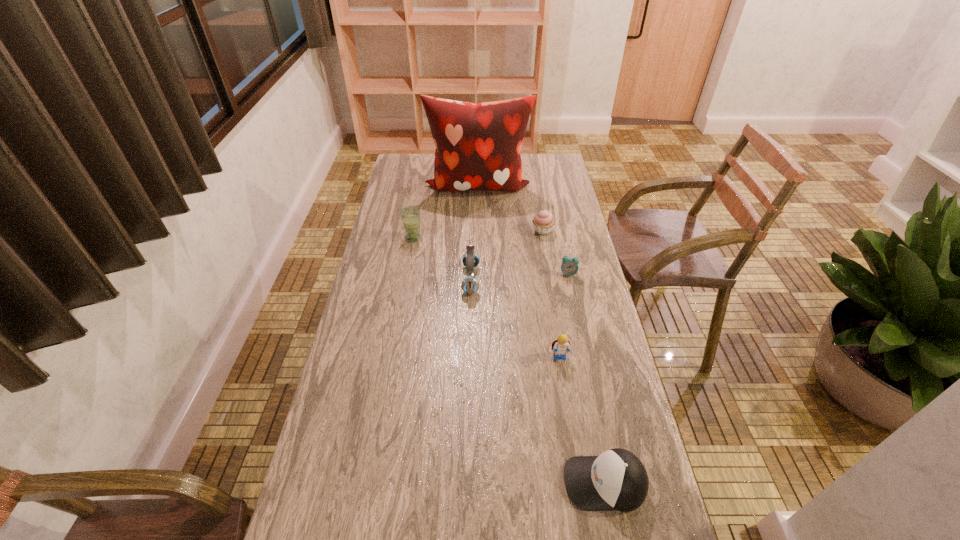
Where is `cushion`? cushion is located at coordinates (478, 146).

At what (x,y) coordinates should I click in order to perform the action: click on the farthest object. Please return your answer as a coordinate pair (x, y). This screenshot has height=540, width=960. Looking at the image, I should click on (478, 146).

Where is `glass`? This screenshot has height=540, width=960. glass is located at coordinates (410, 215).

I want to click on headset, so click(x=470, y=259).

Locate an element on the screen. The height and width of the screenshot is (540, 960). cupcake is located at coordinates (543, 222).

Image resolution: width=960 pixels, height=540 pixels. I want to click on Lego, so click(x=560, y=346).

Identify the location of cap. The width and height of the screenshot is (960, 540). (616, 480).

The image size is (960, 540). Identify the location of alarm clock. (569, 266).

The width and height of the screenshot is (960, 540). What are the coordinates of `vacant region located 0.180m on the front-facing side of the farthest object` in the screenshot? It's located at (477, 228).

I want to click on free space located on the right of the glass, so click(506, 238).